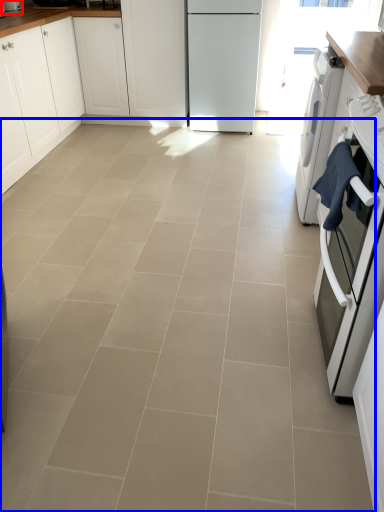
Question: Among these objects, which one is farthest to the camera, kitchen appliance (highlighted by a red box) or ceramic tile (highlighted by a blue box)?

Choices:
 (A) kitchen appliance
 (B) ceramic tile

Answer: (A)